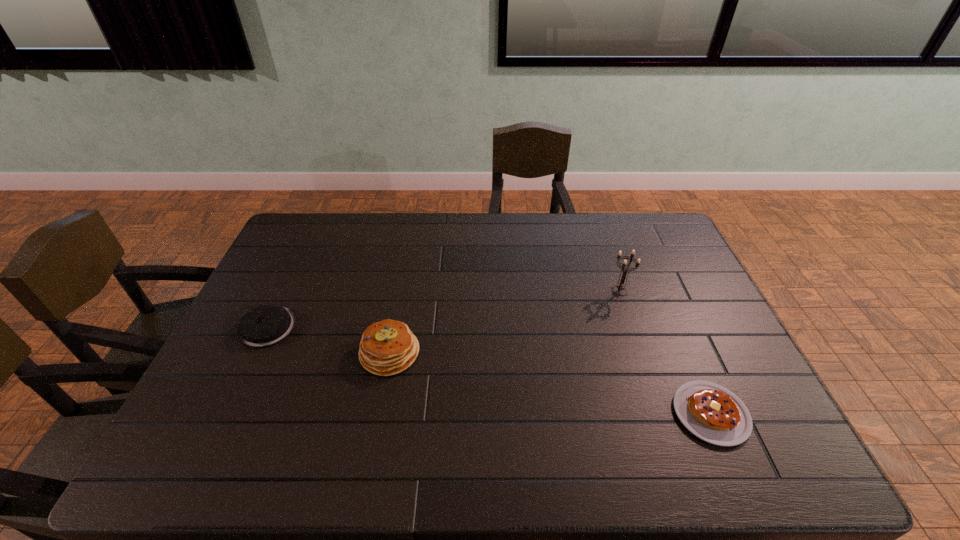
Where is `free space between the second pancake from right to left and the second shortest object`? free space between the second pancake from right to left and the second shortest object is located at coordinates (329, 340).

Find the location of `vacant region between the shortest object and the tallest object`. vacant region between the shortest object and the tallest object is located at coordinates (665, 353).

Where is `the second closest object to the second shortest object`? The width and height of the screenshot is (960, 540). the second closest object to the second shortest object is located at coordinates pos(624,267).

Select which object is the closest to the nearest object. Please provide its 2D coordinates. Your answer should be formatted as a tuple, i.e. [(x, y)], where the tuple contains the x and y coordinates of a point satisfying the conditions above.

[(624, 267)]

Where is `pancake that is the closest to the second pancake from left to right`? This screenshot has height=540, width=960. pancake that is the closest to the second pancake from left to right is located at coordinates (265, 325).

Where is `pancake that stands as the closest to the shortest object`? pancake that stands as the closest to the shortest object is located at coordinates (388, 347).

Find the location of a particular element. This screenshot has width=960, height=540. free space that satisfies the following two spatial constraints: 1. on the front side of the nearest object; 2. on the right side of the leftmost object is located at coordinates (227, 414).